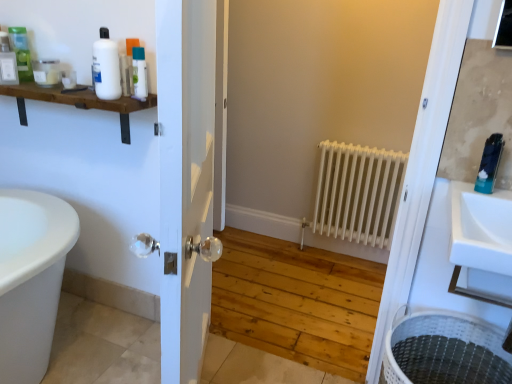
Find the location of a particular element. vacant point to the left of white matte radiator at center is located at coordinates (288, 263).